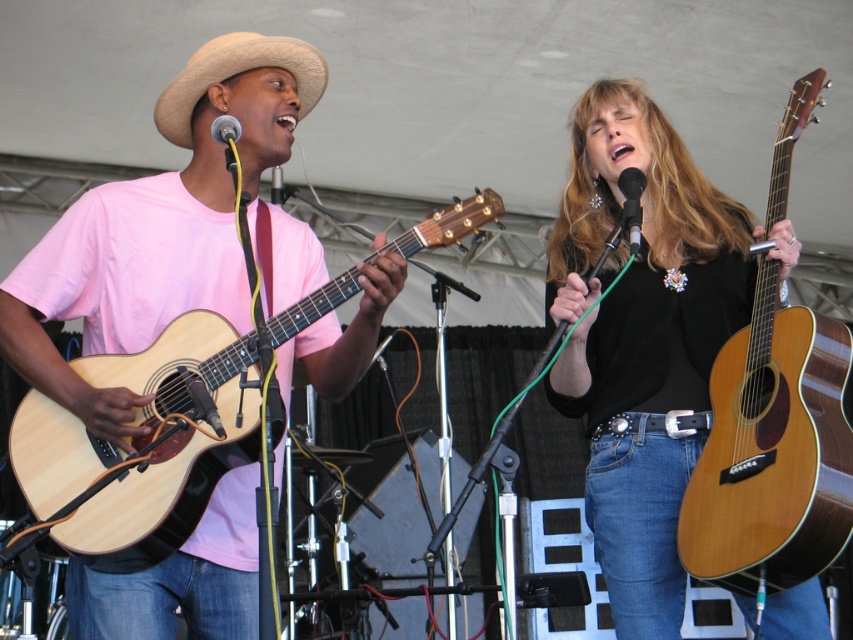
You are a GUI agent. You are given a task and a screenshot of the screen. Output one action in this format:
    pyautogui.click(x=<x>, y=<y>)
    Task: Click on the natural wood acoustic guitar at right
    
    Given the screenshot: What is the action you would take?
    pyautogui.click(x=772, y=452)

Describe the element at coordinates (772, 452) in the screenshot. The height and width of the screenshot is (640, 853). I see `natural wood acoustic guitar at right` at that location.

Locate an element on the screen. natural wood acoustic guitar at right is located at coordinates (772, 452).

Which is more to the right, natural wood acoustic guitar at right or beige straw cowboy hat at upper left?

natural wood acoustic guitar at right

Can you confirm if natural wood acoustic guitar at right is positioned to the left of beige straw cowboy hat at upper left?

In fact, natural wood acoustic guitar at right is to the right of beige straw cowboy hat at upper left.

Who is more distant from viewer, (819, 493) or (213, 76)?

The point (213, 76) is more distant.

You are a GUI agent. You are given a task and a screenshot of the screen. Output one action in this format:
    pyautogui.click(x=<x>, y=<y>)
    Task: Click on the natural wood acoustic guitar at right
    
    Given the screenshot: What is the action you would take?
    pyautogui.click(x=772, y=452)

Is natural wood acoustic guitar at left positioned at the back of black metallic microphone at upper center?

That is False.

Does natural wood acoustic guitar at left have a lesser width compared to black metallic microphone at upper center?

Incorrect, natural wood acoustic guitar at left's width is not less than black metallic microphone at upper center's.

The width and height of the screenshot is (853, 640). In order to click on natural wood acoustic guitar at left in this screenshot , I will do `click(142, 445)`.

This screenshot has height=640, width=853. Find the location of `natural wood acoustic guitar at left`. natural wood acoustic guitar at left is located at coordinates (142, 445).